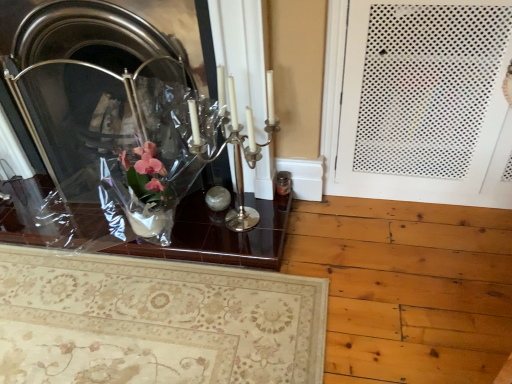
Question: From a real-world perspective, is shiny glass table at center under white perforated door at right?

Choices:
 (A) no
 (B) yes

Answer: (B)

Question: From the image's perspective, is shiny glass table at center below white perforated door at right?

Choices:
 (A) yes
 (B) no

Answer: (A)

Question: Considering the relative sizes of shiny glass table at center and white perforated door at right in the image provided, is shiny glass table at center shorter than white perforated door at right?

Choices:
 (A) yes
 (B) no

Answer: (A)

Question: Can you confirm if shiny glass table at center is bigger than white perforated door at right?

Choices:
 (A) yes
 (B) no

Answer: (B)

Question: From a real-world perspective, is shiny glass table at center over white perforated door at right?

Choices:
 (A) no
 (B) yes

Answer: (A)

Question: Is white perforated door at right taller or shorter than shiny glass table at center?

Choices:
 (A) tall
 (B) short

Answer: (A)

Question: From a real-world perspective, relative to shiny glass table at center, is white perforated door at right vertically above or below?

Choices:
 (A) below
 (B) above

Answer: (B)

Question: Relative to shiny glass table at center, is white perforated door at right in front or behind?

Choices:
 (A) behind
 (B) front

Answer: (B)

Question: Based on their positions, is white perforated door at right located to the left or right of shiny glass table at center?

Choices:
 (A) right
 (B) left

Answer: (A)

Question: Considering the positions of shiny glass table at center and clear glass fireplace at upper left in the image, is shiny glass table at center taller or shorter than clear glass fireplace at upper left?

Choices:
 (A) short
 (B) tall

Answer: (A)

Question: Considering the positions of shiny glass table at center and clear glass fireplace at upper left in the image, is shiny glass table at center wider or thinner than clear glass fireplace at upper left?

Choices:
 (A) wide
 (B) thin

Answer: (A)

Question: Considering their positions, is shiny glass table at center located in front of or behind clear glass fireplace at upper left?

Choices:
 (A) front
 (B) behind

Answer: (B)

Question: From a real-world perspective, is shiny glass table at center physically located above or below clear glass fireplace at upper left?

Choices:
 (A) below
 (B) above

Answer: (A)

Question: In terms of size, does shiny glass table at center appear bigger or smaller than white perforated door at right?

Choices:
 (A) big
 (B) small

Answer: (B)

Question: From the image's perspective, is shiny glass table at center located above or below white perforated door at right?

Choices:
 (A) below
 (B) above

Answer: (A)